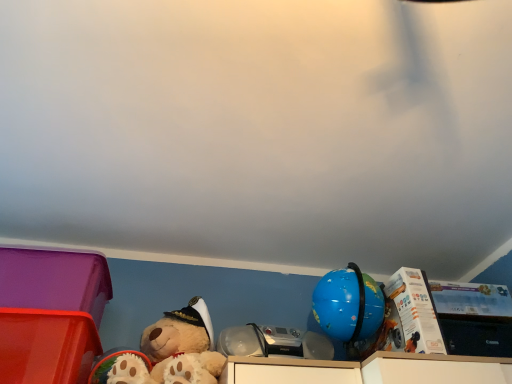
Question: Is white cardboard box at upper right, acting as the 1th storage box starting from the right, behind fluffy beige teddy bear at lower left?

Choices:
 (A) no
 (B) yes

Answer: (B)

Question: Would you say white cardboard box at upper right, the 3th storage box viewed from the left, is outside fluffy beige teddy bear at lower left?

Choices:
 (A) yes
 (B) no

Answer: (A)

Question: Is white cardboard box at upper right, the 3th storage box viewed from the left, thinner than fluffy beige teddy bear at lower left?

Choices:
 (A) yes
 (B) no

Answer: (A)

Question: Is white cardboard box at upper right, the 3th storage box viewed from the left, not near fluffy beige teddy bear at lower left?

Choices:
 (A) no
 (B) yes

Answer: (A)

Question: Does white cardboard box at upper right, the 3th storage box viewed from the left, touch fluffy beige teddy bear at lower left?

Choices:
 (A) no
 (B) yes

Answer: (A)

Question: Would you say matte plastic storage box at lower left, which is the second storage box from left to right, is to the left or to the right of matte plastic storage box at lower left, the 1th storage box viewed from the left, in the picture?

Choices:
 (A) left
 (B) right

Answer: (B)

Question: Considering the positions of matte plastic storage box at lower left, which is counted as the 2th storage box, starting from the right, and matte plastic storage box at lower left, placed as the 3th storage box when sorted from right to left, in the image, is matte plastic storage box at lower left, which is counted as the 2th storage box, starting from the right, taller or shorter than matte plastic storage box at lower left, placed as the 3th storage box when sorted from right to left,?

Choices:
 (A) short
 (B) tall

Answer: (B)

Question: From a real-world perspective, is matte plastic storage box at lower left, which is counted as the 2th storage box, starting from the right, above or below matte plastic storage box at lower left, the 1th storage box viewed from the left?

Choices:
 (A) above
 (B) below

Answer: (B)

Question: Is matte plastic storage box at lower left, which is the second storage box from left to right, bigger or smaller than matte plastic storage box at lower left, placed as the 3th storage box when sorted from right to left?

Choices:
 (A) big
 (B) small

Answer: (B)

Question: Based on their sizes in the image, would you say white cardboard box at upper right, acting as the 1th storage box starting from the right, is bigger or smaller than matte plastic storage box at lower left, placed as the 3th storage box when sorted from right to left?

Choices:
 (A) big
 (B) small

Answer: (B)

Question: Considering the positions of point (461, 347) and point (15, 289), is point (461, 347) closer or farther from the camera than point (15, 289)?

Choices:
 (A) farther
 (B) closer

Answer: (A)

Question: Relative to matte plastic storage box at lower left, placed as the 3th storage box when sorted from right to left, is white cardboard box at upper right, acting as the 1th storage box starting from the right, in front or behind?

Choices:
 (A) front
 (B) behind

Answer: (B)

Question: Is white cardboard box at upper right, the 3th storage box viewed from the left, inside or outside of matte plastic storage box at lower left, the 1th storage box viewed from the left?

Choices:
 (A) outside
 (B) inside

Answer: (A)

Question: Is white cardboard box at upper right, acting as the 1th storage box starting from the right, spatially inside fluffy beige teddy bear at lower left, or outside of it?

Choices:
 (A) outside
 (B) inside

Answer: (A)

Question: Looking at the image, does white cardboard box at upper right, the 3th storage box viewed from the left, seem bigger or smaller compared to fluffy beige teddy bear at lower left?

Choices:
 (A) big
 (B) small

Answer: (B)